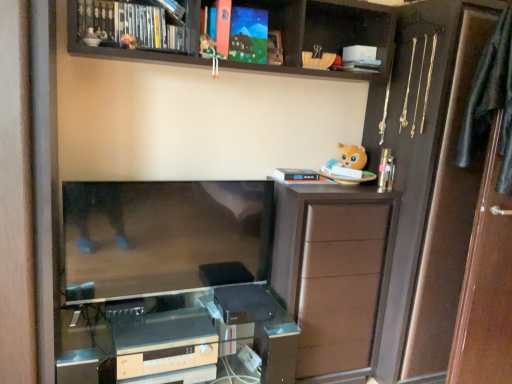
Question: Does white matte book at upper center, acting as the fifth book starting from the left, appear on the left side of white matte book at upper center, the 4th book when ordered from left to right?

Choices:
 (A) no
 (B) yes

Answer: (A)

Question: Is white matte book at upper center, the 4th book when ordered from top to bottom, oriented towards white matte book at upper center, arranged as the 5th book when viewed from the top?

Choices:
 (A) yes
 (B) no

Answer: (B)

Question: Considering the relative sizes of white matte book at upper center, the first book in the right-to-left sequence, and white matte book at upper center, arranged as the first book when ordered from the bottom, in the image provided, is white matte book at upper center, the first book in the right-to-left sequence, wider than white matte book at upper center, arranged as the first book when ordered from the bottom,?

Choices:
 (A) yes
 (B) no

Answer: (A)

Question: From the image's perspective, is white matte book at upper center, the 4th book when ordered from top to bottom, under white matte book at upper center, arranged as the 5th book when viewed from the top?

Choices:
 (A) yes
 (B) no

Answer: (B)

Question: Considering the relative sizes of white matte book at upper center, the 4th book when ordered from top to bottom, and white matte book at upper center, the second book in the right-to-left sequence, in the image provided, is white matte book at upper center, the 4th book when ordered from top to bottom, bigger than white matte book at upper center, the second book in the right-to-left sequence,?

Choices:
 (A) no
 (B) yes

Answer: (A)

Question: Considering their positions, is matte plastic toy at upper center, which is the first toy in left-to-right order, located in front of or behind white matte book at upper center, the first book in the right-to-left sequence?

Choices:
 (A) front
 (B) behind

Answer: (A)

Question: Choose the correct answer: Is matte plastic toy at upper center, which is the first toy in left-to-right order, inside white matte book at upper center, marked as the 2th book in a bottom-to-top arrangement, or outside it?

Choices:
 (A) outside
 (B) inside

Answer: (A)

Question: From the image's perspective, relative to white matte book at upper center, the 4th book when ordered from top to bottom, is matte plastic toy at upper center, which is the first toy in left-to-right order, above or below?

Choices:
 (A) below
 (B) above

Answer: (A)

Question: Considering the positions of matte plastic toy at upper center, which appears as the 2th toy when viewed from the right, and white matte book at upper center, the first book in the right-to-left sequence, in the image, is matte plastic toy at upper center, which appears as the 2th toy when viewed from the right, taller or shorter than white matte book at upper center, the first book in the right-to-left sequence,?

Choices:
 (A) tall
 (B) short

Answer: (A)

Question: Based on their positions, is matte plastic toy at upper center, which appears as the 2th toy when viewed from the right, located to the left or right of transparent glass door at right?

Choices:
 (A) left
 (B) right

Answer: (A)

Question: Considering the positions of matte plastic toy at upper center, which is the first toy in left-to-right order, and transparent glass door at right in the image, is matte plastic toy at upper center, which is the first toy in left-to-right order, taller or shorter than transparent glass door at right?

Choices:
 (A) short
 (B) tall

Answer: (A)

Question: From the image's perspective, is matte plastic toy at upper center, which appears as the 2th toy when viewed from the right, above or below transparent glass door at right?

Choices:
 (A) below
 (B) above

Answer: (B)

Question: From a real-world perspective, is matte plastic toy at upper center, which appears as the 2th toy when viewed from the right, above or below transparent glass door at right?

Choices:
 (A) below
 (B) above

Answer: (B)

Question: From a real-world perspective, is black plastic game console at lower center, which is counted as the 1th appliance, starting from the top, physically located above or below brown matte cabinet at right?

Choices:
 (A) above
 (B) below

Answer: (B)

Question: Is point (253, 312) closer or farther from the camera than point (340, 332)?

Choices:
 (A) closer
 (B) farther

Answer: (A)